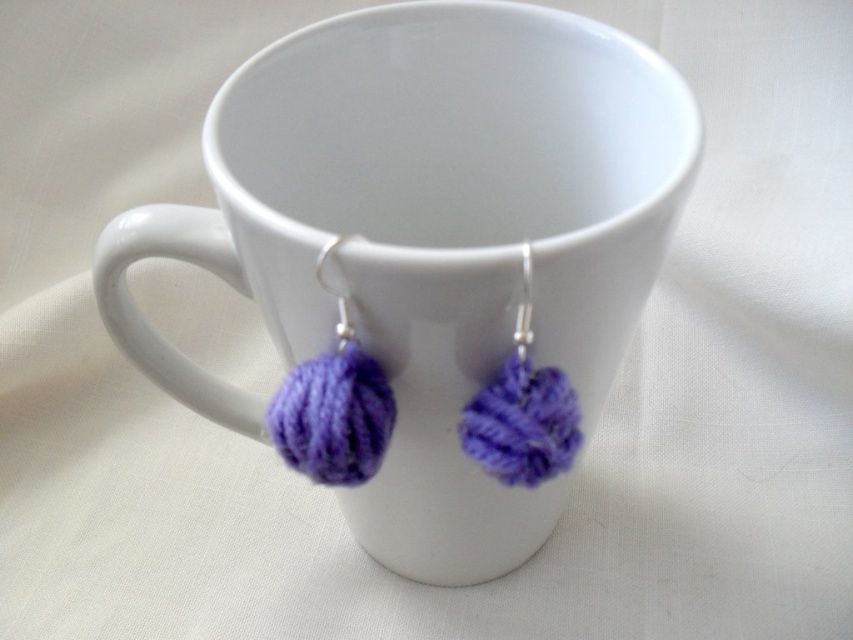
Which is below, white ceramic mug at center or purple yarn pom-pom at left?

Positioned lower is purple yarn pom-pom at left.

Does white ceramic mug at center appear over purple yarn pom-pom at left?

Indeed, white ceramic mug at center is positioned over purple yarn pom-pom at left.

Where is `white ceramic mug at center`? white ceramic mug at center is located at coordinates (428, 237).

Does white ceramic mug at center appear on the right side of purple yarn ball at center?

In fact, white ceramic mug at center is to the left of purple yarn ball at center.

Can you confirm if white ceramic mug at center is taller than purple yarn ball at center?

Indeed, white ceramic mug at center has a greater height compared to purple yarn ball at center.

You are a GUI agent. You are given a task and a screenshot of the screen. Output one action in this format:
    pyautogui.click(x=<x>, y=<y>)
    Task: Click on the white ceramic mug at center
    
    Given the screenshot: What is the action you would take?
    (x=428, y=237)

Is purple yarn pom-pom at left below purple yarn ball at center?

Indeed, purple yarn pom-pom at left is positioned under purple yarn ball at center.

Is purple yarn pom-pom at left bigger than purple yarn ball at center?

No.

Does point (335, 442) come in front of point (561, 451)?

That is True.

What are the coordinates of `purple yarn pom-pom at left` in the screenshot? It's located at (334, 403).